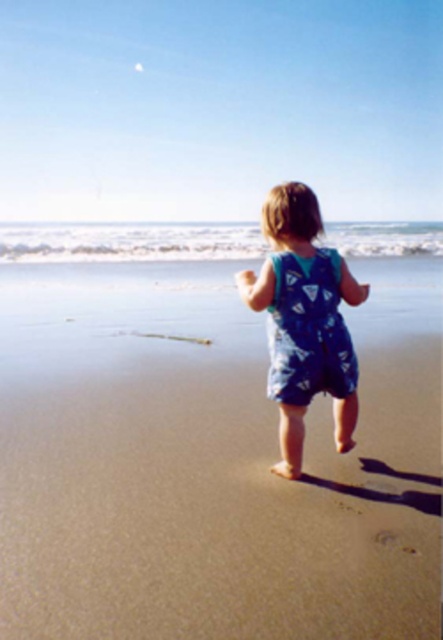
You are a photographer trying to capture the child in the scene. Since you want to focus on the blue fabric baby at center and the blue cotton onesie at center, which one should you zoom in on first to ensure it appears larger in your photo?

The blue fabric baby at center is closer to the viewer than the blue cotton onesie at center, so zoom in on the blue fabric baby at center first to make it appear larger.

You are a photographer trying to capture the child in the scene. Since the child is wearing both the blue fabric baby at center and the blue cotton onesie at center, which one would you focus on to ensure the clothing detail is clear?

The blue fabric baby at center has a larger size compared to the blue cotton onesie at center, so focusing on the blue fabric baby at center would allow for clearer clothing detail.